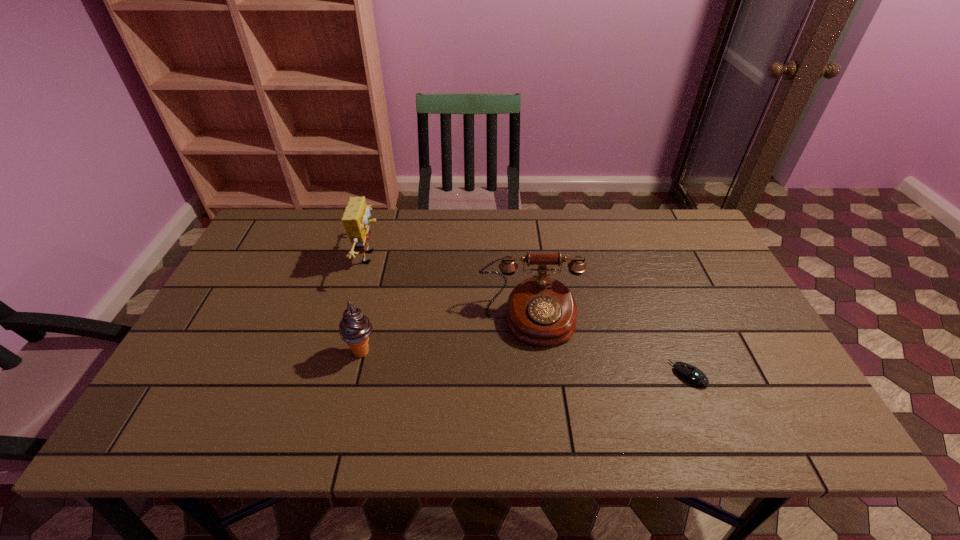
This screenshot has height=540, width=960. I want to click on vacant area that satisfies the following two spatial constraints: 1. on the face of the sponge; 2. on the left side of the computer mouse, so click(338, 375).

What are the coordinates of `free spot that satisfies the following two spatial constraints: 1. on the face of the icecream; 2. on the left side of the farthest object` in the screenshot? It's located at 344,352.

Find the location of a particular element. Image resolution: width=960 pixels, height=540 pixels. vacant space that satisfies the following two spatial constraints: 1. on the face of the sponge; 2. on the back side of the computer mouse is located at coordinates (338, 375).

Locate an element on the screen. The image size is (960, 540). vacant point that satisfies the following two spatial constraints: 1. on the face of the farthest object; 2. on the left side of the icecream is located at coordinates (344, 352).

At what (x,y) coordinates should I click in order to perform the action: click on free spot that satisfies the following two spatial constraints: 1. on the back side of the rightmost object; 2. on the face of the farthest object. Please return your answer as a coordinate pair (x, y). Looking at the image, I should click on click(640, 257).